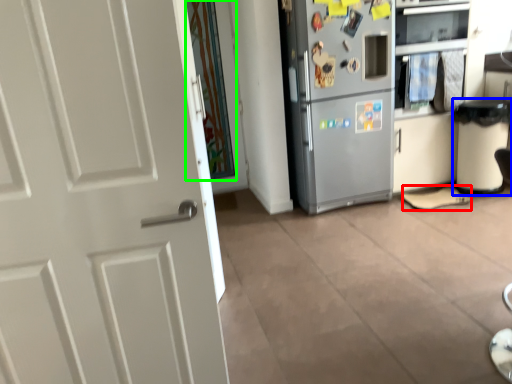
Question: Estimate the real-world distances between objects in this image. Which object is closer to shoe (highlighted by a red box), trash bin/can (highlighted by a blue box) or glass door (highlighted by a green box)?

Choices:
 (A) trash bin/can
 (B) glass door

Answer: (A)